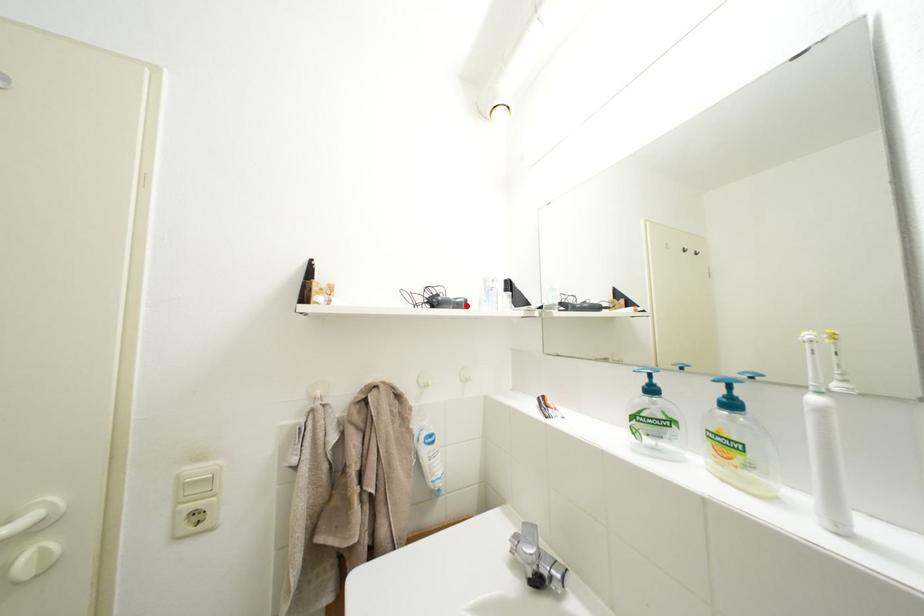
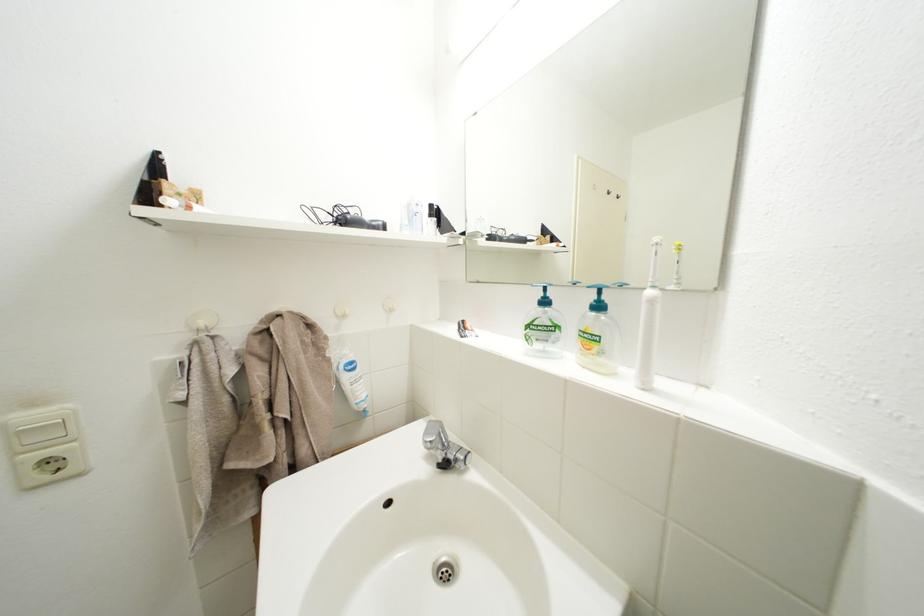
Locate, in the second image, the point that corresponds to the highlighted location in the first image.

(383, 228)